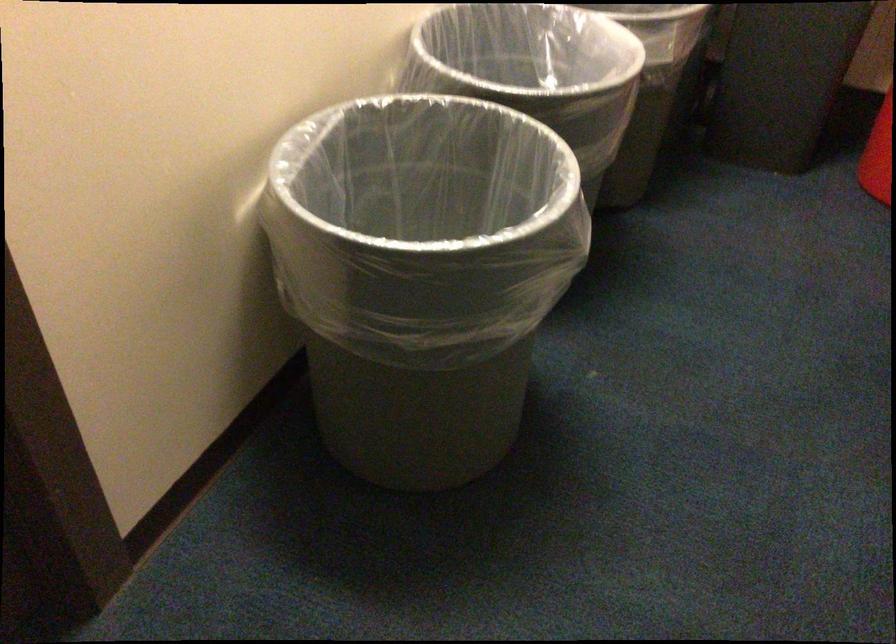
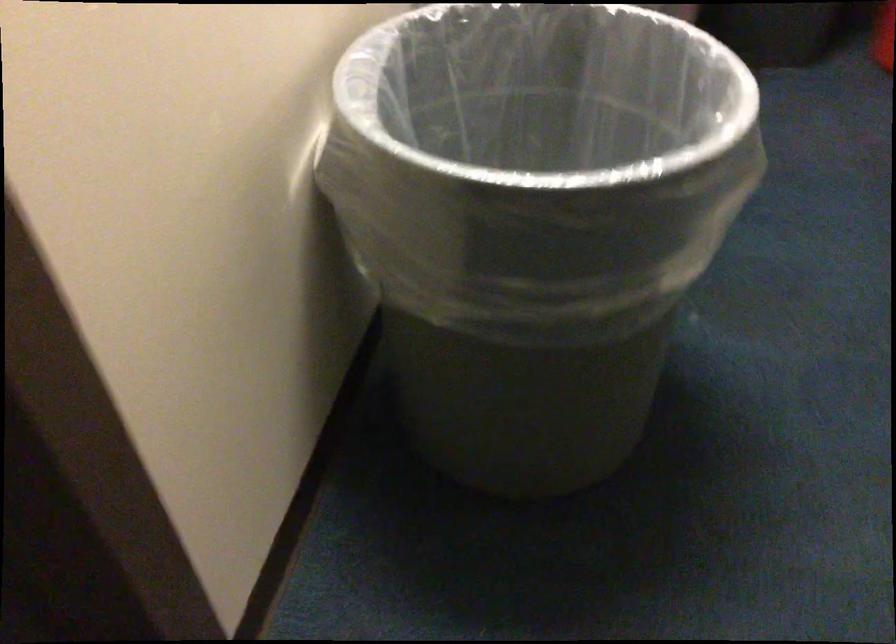
Which direction would the cameraman need to move to produce the second image?

The cameraman moved toward left, forward.